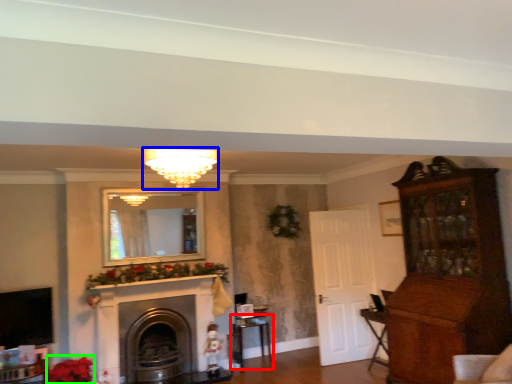
Question: Which object is positioned closest to table (highlighted by a red box)? Select from light fixture (highlighted by a blue box) and flower (highlighted by a green box).

Choices:
 (A) light fixture
 (B) flower

Answer: (B)